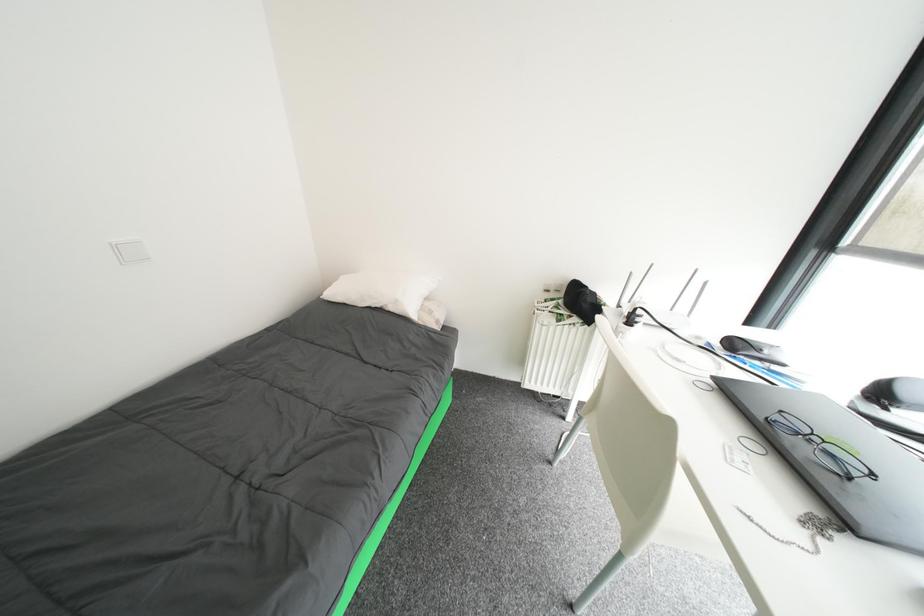
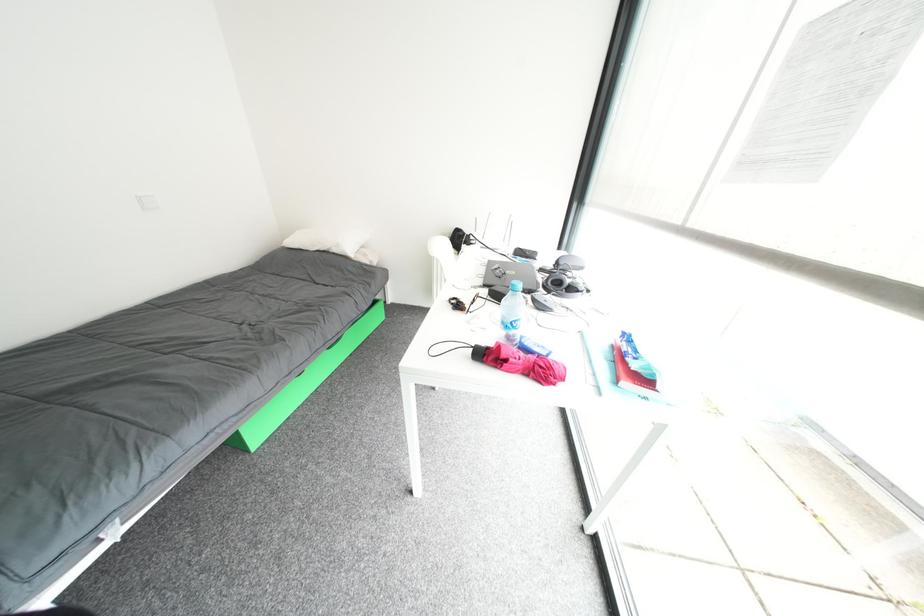
Question: Based on the continuous images, in which direction is the camera rotating? Reply with the corresponding letter.

Choices:
 (A) Left
 (B) Right
 (C) Up
 (D) Down

Answer: (B)